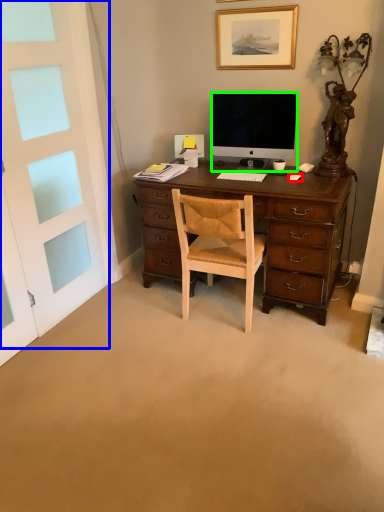
Question: Which object is the farthest from computer mouse (highlighted by a red box)? Choose among these: screen door (highlighted by a blue box) or television (highlighted by a green box).

Choices:
 (A) screen door
 (B) television

Answer: (A)